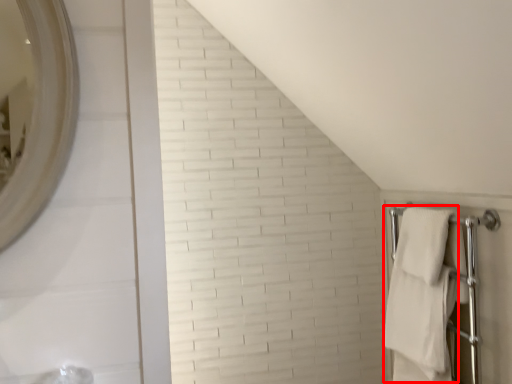
Question: Observing the image, what is the correct spatial positioning of bath towel (annotated by the red box) in reference to bath towel?

Choices:
 (A) left
 (B) right

Answer: (A)